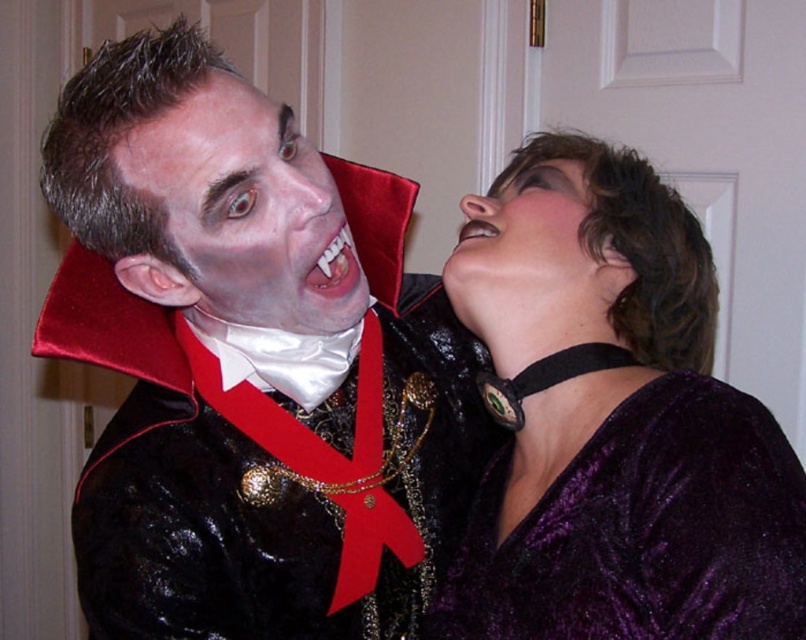
Is point (725, 464) positioned in front of point (507, 296)?

Yes, it is in front of point (507, 296).

This screenshot has height=640, width=806. I want to click on velvet purple dress at upper right, so click(x=613, y=422).

Can you confirm if velvet purple dress at upper right is bigger than pink glossy lips at upper center?

Yes.

Based on the photo, is the position of velvet purple dress at upper right less distant than that of pink glossy lips at upper center?

Yes, velvet purple dress at upper right is in front of pink glossy lips at upper center.

Is point (626, 152) farther from camera compared to point (459, 248)?

Yes, it is.

Locate an element on the screen. The width and height of the screenshot is (806, 640). velvet purple dress at upper right is located at coordinates (613, 422).

Is velvet purple choker at upper right to the right of white glossy teeth at center from the viewer's perspective?

Indeed, velvet purple choker at upper right is positioned on the right side of white glossy teeth at center.

At what (x,y) coordinates should I click in order to perform the action: click on velvet purple choker at upper right. Please return your answer as a coordinate pair (x, y). The height and width of the screenshot is (640, 806). Looking at the image, I should click on (642, 531).

Find the location of `velvet purple choker at upper right`. velvet purple choker at upper right is located at coordinates (642, 531).